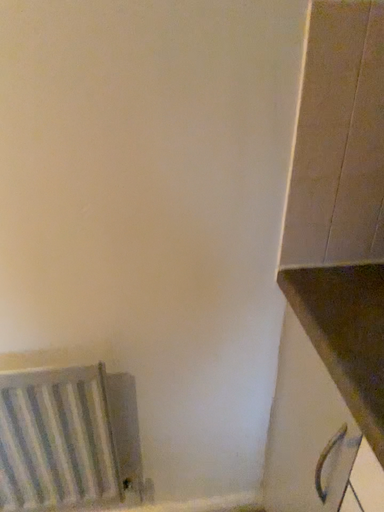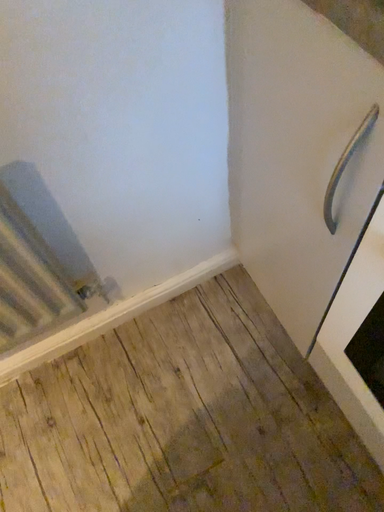
Question: Which way did the camera rotate in the video?

Choices:
 (A) rotated left
 (B) rotated right

Answer: (B)